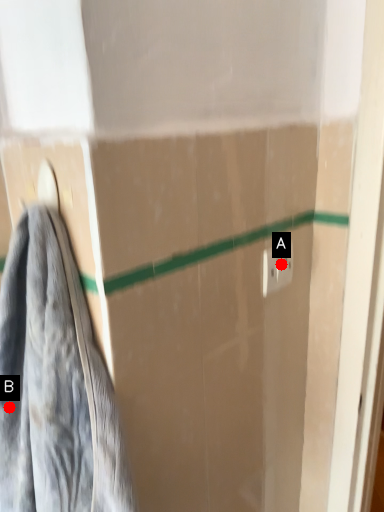
Question: Two points are circled on the image, labeled by A and B beside each circle. Which of the following is the closest to the observer?

Choices:
 (A) A is closer
 (B) B is closer

Answer: (B)